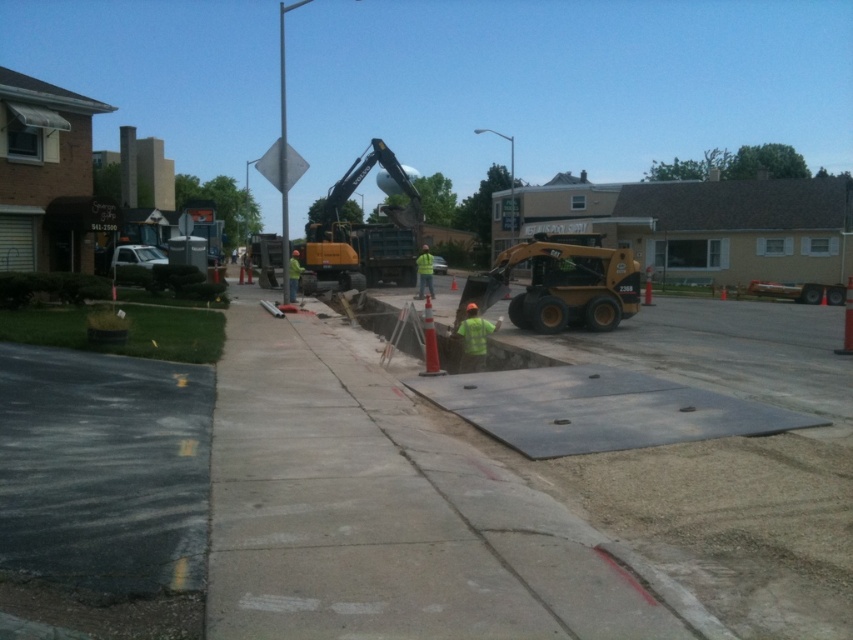
You are a safety inspector standing at the edge of the construction site. You notice the yellow rubber excavator at center and the green reflective vest at center. According to safety regulations, the minimum safe distance between heavy machinery and workers must be at least 50 meters. Is the current distance compliant with the safety standards?

The distance between the yellow rubber excavator at center and the green reflective vest at center is 44.67 meters, which is less than the required 50 meters. Therefore, the current distance does not comply with the safety standards.

You are a construction worker wearing a green reflective vest at center. You need to step onto the gray concrete pavement at center to secure the protective sheet. Which direction should you move from your current position?

The gray concrete pavement at center is to the right of the green reflective vest at center, so you should move to your right to reach it.